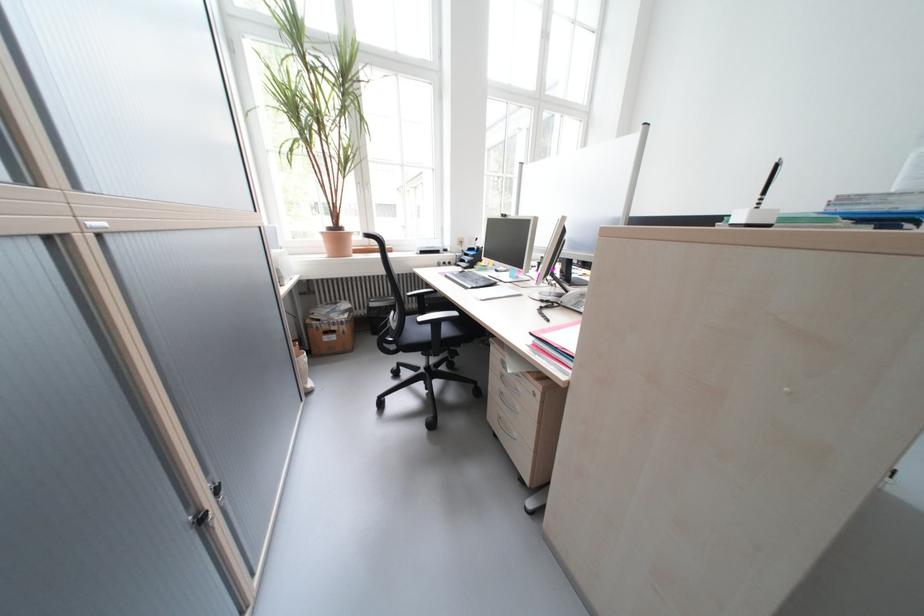
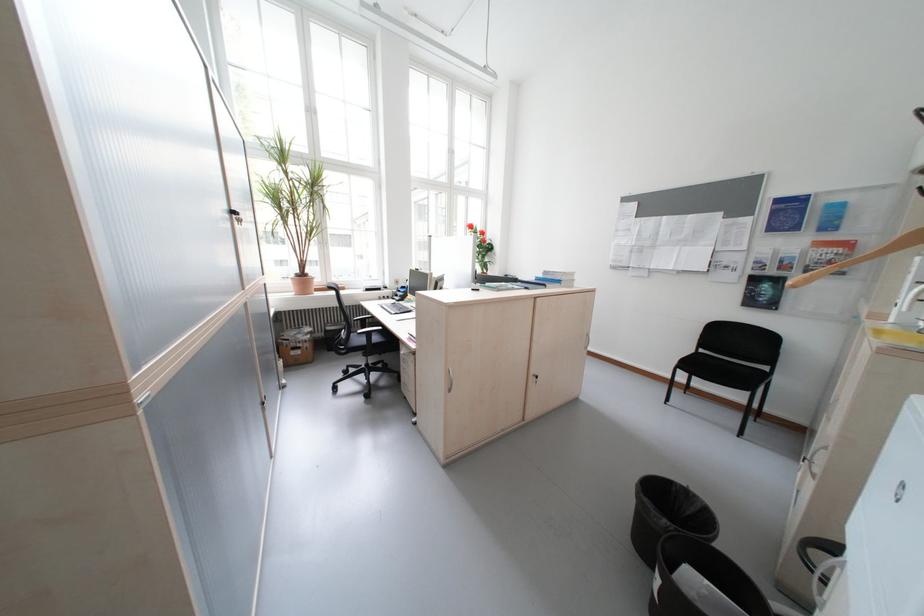
The point at (339, 231) is marked in the first image. Where is the corresponding point in the second image?

(308, 277)